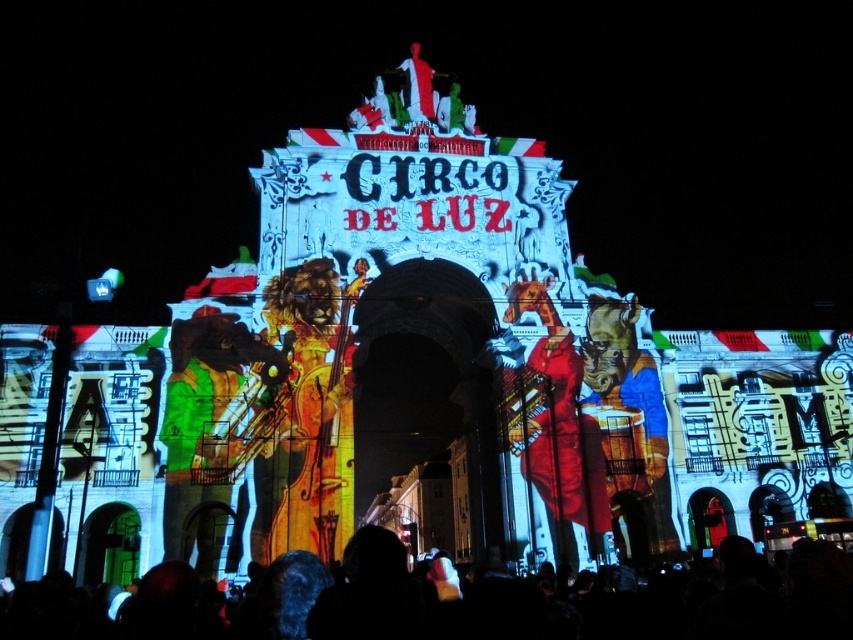
Who is positioned more to the right, black matte crowd at lower center or metallic gold statue at center?

metallic gold statue at center

Which of these two, black matte crowd at lower center or metallic gold statue at center, stands taller?

With more height is metallic gold statue at center.

This screenshot has height=640, width=853. What do you see at coordinates (546, 600) in the screenshot?
I see `black matte crowd at lower center` at bounding box center [546, 600].

Identify the location of black matte crowd at lower center. The image size is (853, 640). (546, 600).

Is shiny gold violin at center shorter than metallic gold statue at center?

A: Yes.

Based on the photo, is shiny gold violin at center above metallic gold statue at center?

Indeed, shiny gold violin at center is positioned over metallic gold statue at center.

Does point (312, 346) come farther from viewer compared to point (625, 528)?

No, (312, 346) is in front of (625, 528).

Where is `shiny gold violin at center`? This screenshot has height=640, width=853. shiny gold violin at center is located at coordinates (308, 413).

Who is positioned more to the left, shiny gold violin at center or green fabric musician at center?

Positioned to the left is green fabric musician at center.

Identify the location of shiny gold violin at center. This screenshot has width=853, height=640. (308, 413).